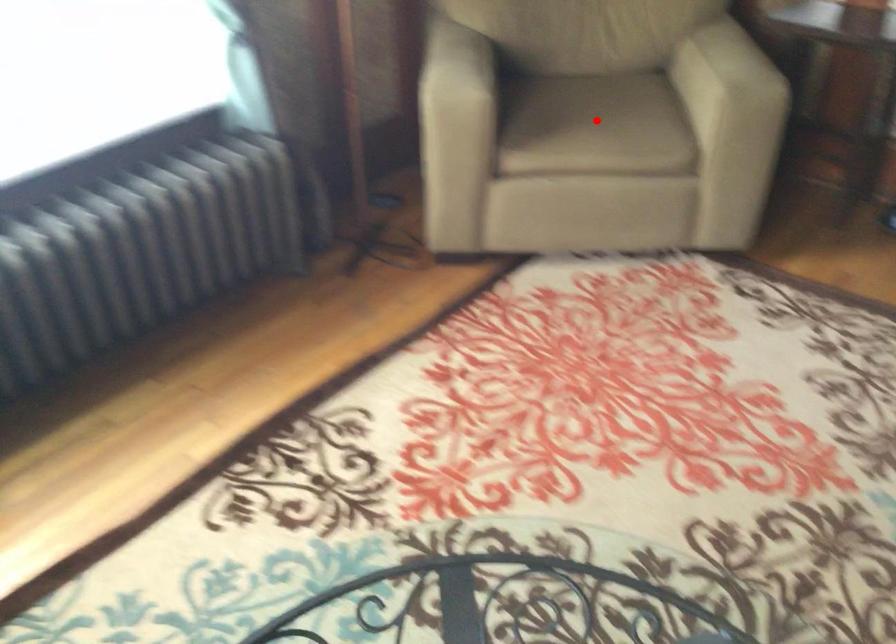
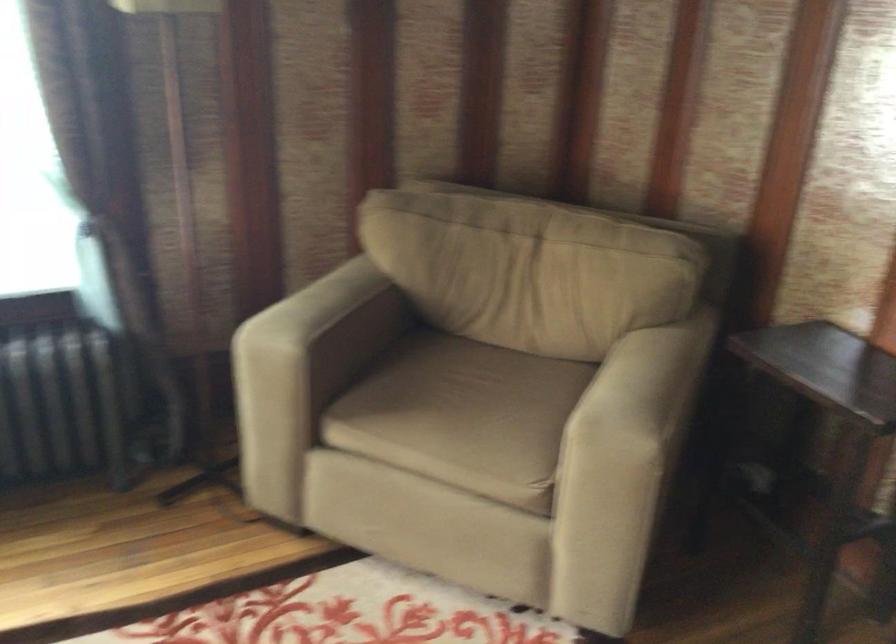
In the second image, find the point that corresponds to the highlighted location in the first image.

(458, 413)